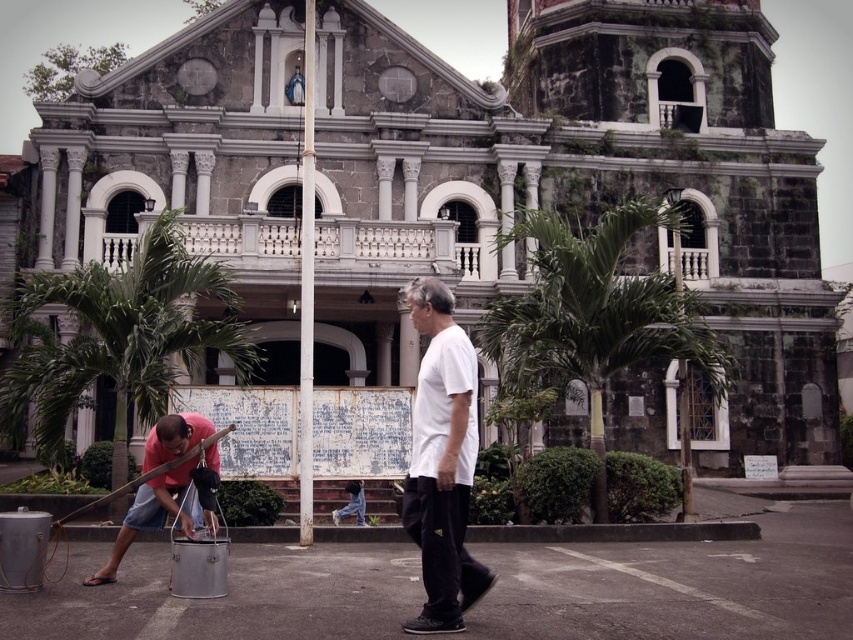
Consider the image. Who is positioned more to the right, white matte shirt at center or brushed metal bucket at lower left?

white matte shirt at center is more to the right.

Does white matte shirt at center have a larger size compared to brushed metal bucket at lower left?

Yes.

Which is behind, point (459, 420) or point (173, 468)?

Point (173, 468)

Locate an element on the screen. The width and height of the screenshot is (853, 640). white matte shirt at center is located at coordinates (442, 461).